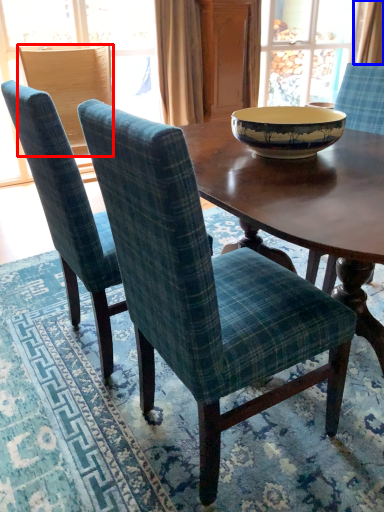
Question: Which object appears closest to the camera in this image, chair (highlighted by a red box) or curtain (highlighted by a blue box)?

Choices:
 (A) chair
 (B) curtain

Answer: (A)